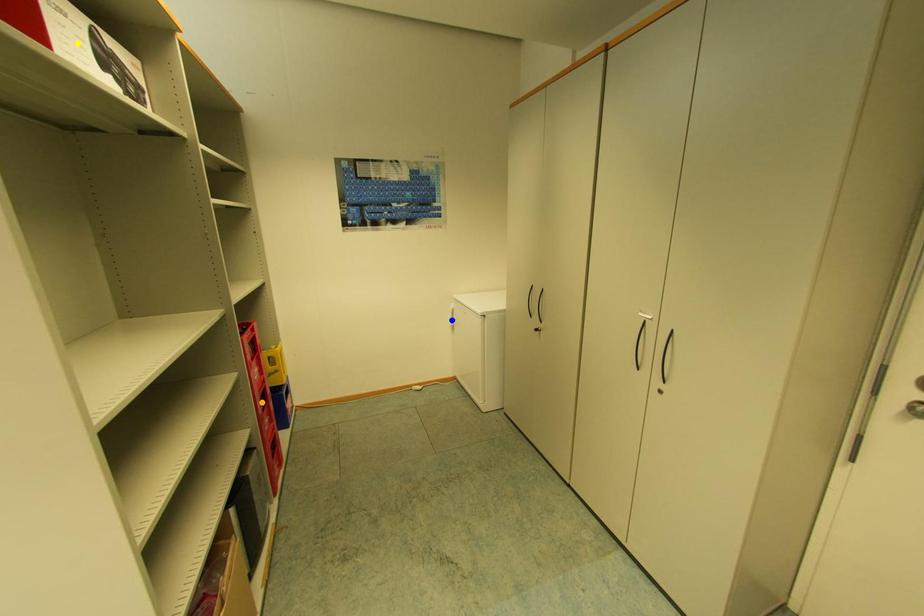
Order these from nearest to farthest:
1. yellow point
2. blue point
3. orange point

yellow point < orange point < blue point